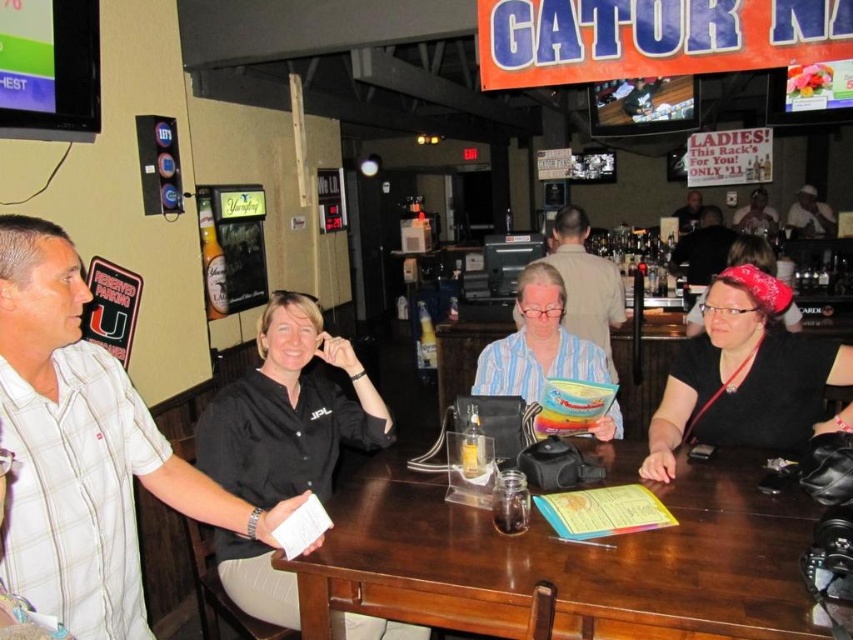
You are a waiter at Gator. You need to deliver a drink to the customer sitting near the striped cotton shirt at center. However, there is a black leather purse at lower right on the floor. Can you walk between them to reach the customer without stepping on the purse?

The black leather purse at lower right is 16.39 inches away from the striped cotton shirt at center. Since 16.39 inches is approximately 1.36 feet, there is enough space for the waiter to walk between them without stepping on the purse.

You are a delivery person holding a package that needs to be placed on the brown wood table at center. If your arms can extend 1 meter, can you reach the table from where you are standing?

The distance between you and the brown wood table at center is 1.34 meters, which exceeds your arm extension of 1 meter. Therefore, you cannot reach the table with your arms alone.